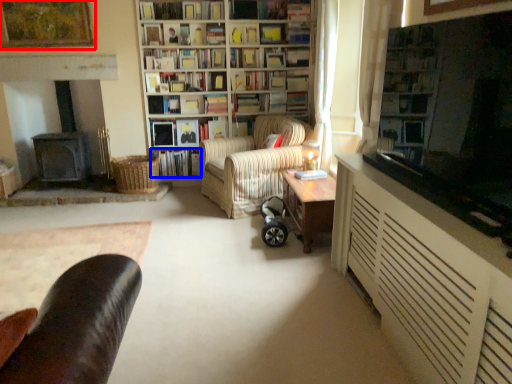
Question: Which object is further to the camera taking this photo, picture frame (highlighted by a red box) or book (highlighted by a blue box)?

Choices:
 (A) picture frame
 (B) book

Answer: (B)